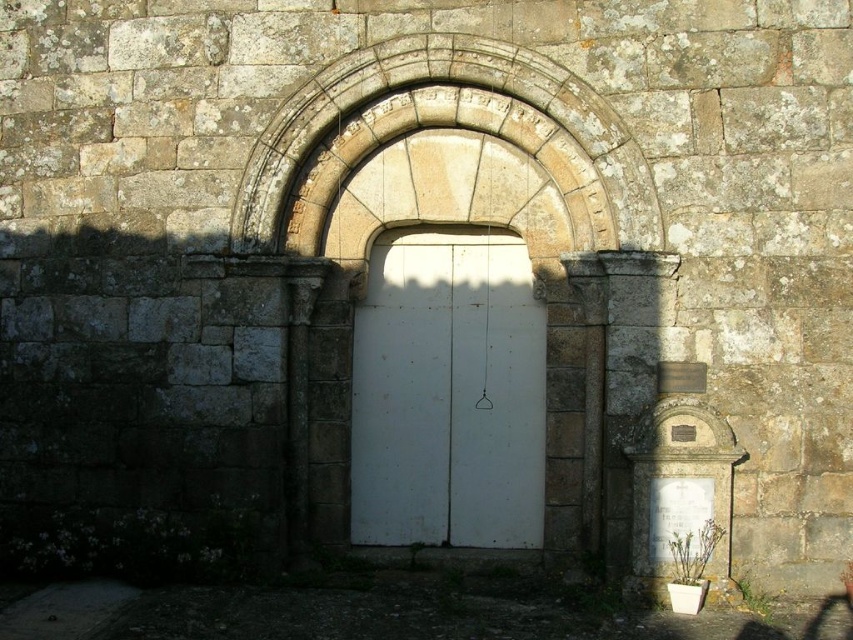
Is white matte door at center thinner than stone textured archway at center?

Yes.

Is point (543, 458) closer to camera compared to point (315, 136)?

No, it is behind (315, 136).

Image resolution: width=853 pixels, height=640 pixels. Find the location of `white matte door at center`. white matte door at center is located at coordinates (448, 392).